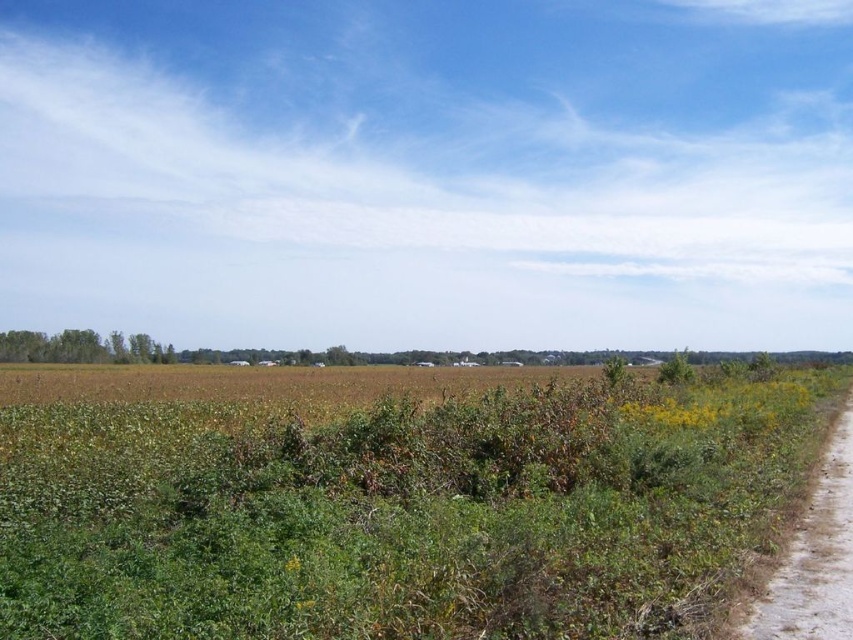
You are standing at the dirt path on the right side of the frame and want to walk towards the distant farm buildings. Which point, point(646, 451) or point(846, 525), is closer to you as you start walking?

Point(646, 451) is closer to you because it is further to the viewer than point(846, 525), meaning it is physically nearer to your current position on the dirt path.

You are a farmer planning to plant a row of sunflowers between the green leafy grass at center and the dirt track at right. Which area has enough space for the sunflowers to grow without overcrowding?

The green leafy grass at center has a larger width than the dirt track at right, so it provides more space for the sunflowers to grow without overcrowding.